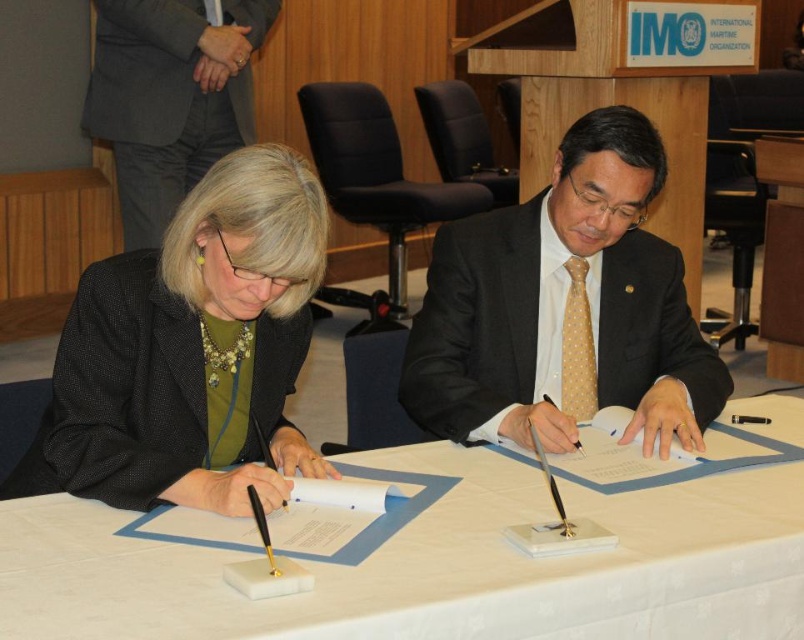
Question: Does white paper at center have a lesser width compared to matte black suit at center?

Choices:
 (A) yes
 (B) no

Answer: (B)

Question: Based on their relative distances, which object is farther from the white paper at center?

Choices:
 (A) matte black suit at center
 (B) dark gray suit at upper left
 (C) black fabric jacket at center

Answer: (B)

Question: Can you confirm if matte black suit at center is thinner than dark gray suit at upper left?

Choices:
 (A) no
 (B) yes

Answer: (B)

Question: Which point is closer to the camera?

Choices:
 (A) matte black suit at center
 (B) black fabric jacket at center
 (C) dark gray suit at upper left
 (D) white paper at center

Answer: (D)

Question: Is white paper at center to the right of matte black suit at center from the viewer's perspective?

Choices:
 (A) no
 (B) yes

Answer: (A)

Question: Which object appears farthest from the camera in this image?

Choices:
 (A) matte black suit at center
 (B) white paper at center
 (C) black fabric jacket at center
 (D) dark gray suit at upper left

Answer: (D)